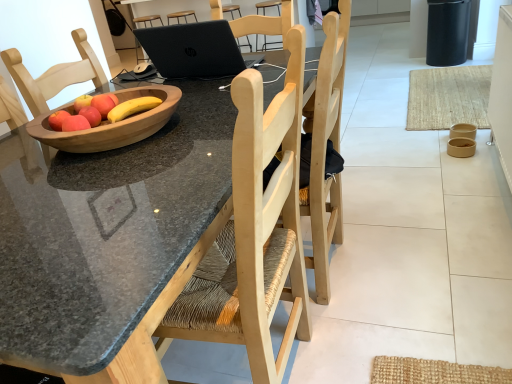
Where is `free space behind matte brown bowl at right, the 1th bowl viewed from the right`? free space behind matte brown bowl at right, the 1th bowl viewed from the right is located at coordinates (442, 127).